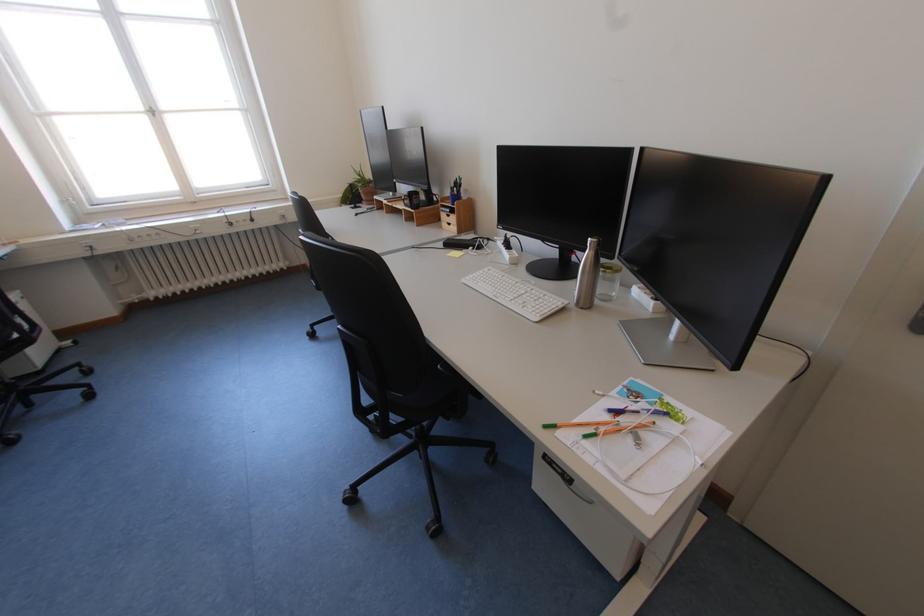
The image size is (924, 616). Find the location of `black mug`. black mug is located at coordinates (411, 199).